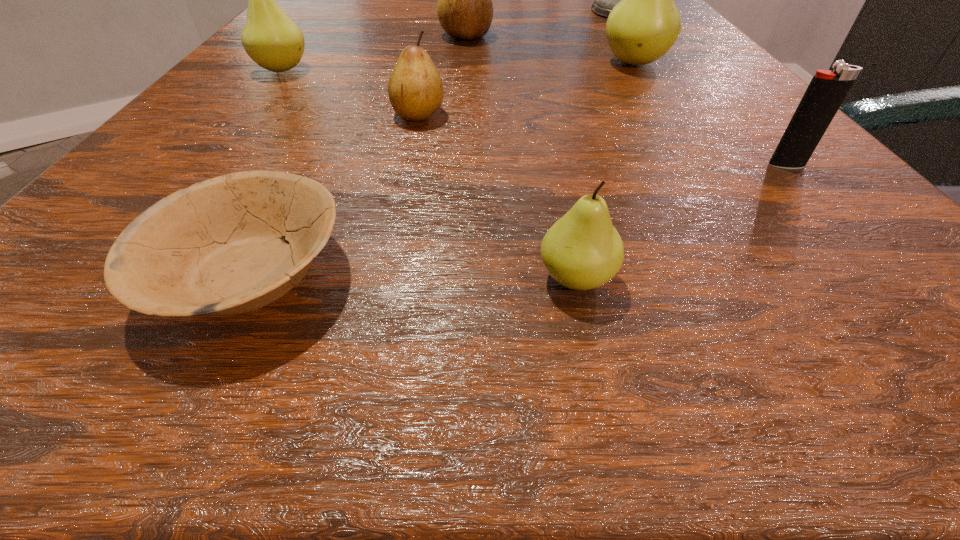
Locate an element on the screen. The height and width of the screenshot is (540, 960). vacant area that lies between the second green pear from right to left and the fourth nearest object is located at coordinates [x=497, y=196].

The width and height of the screenshot is (960, 540). I want to click on free point between the second smallest green pear and the aerosol can, so click(452, 40).

You are a GUI agent. You are given a task and a screenshot of the screen. Output one action in this format:
    pyautogui.click(x=<x>, y=<y>)
    Task: Click on the vacant space in between the black igniter and the second tallest object
    
    Given the screenshot: What is the action you would take?
    pyautogui.click(x=710, y=114)

You are a GUI agent. You are given a task and a screenshot of the screen. Output one action in this format:
    pyautogui.click(x=<x>, y=<y>)
    Task: Click on the unoccupied area between the second tallest object and the farthest pear
    
    Given the screenshot: What is the action you would take?
    pyautogui.click(x=550, y=50)

Locate an element on the screen. free space between the second pear from right to left and the fifth farthest object is located at coordinates (497, 196).

Identify the location of free space between the second farthest object and the second green pear from right to left. (521, 157).

This screenshot has height=540, width=960. Identify the location of vacant point located between the nearer brown pear and the tallest pear. (526, 89).

The image size is (960, 540). What are the coordinates of `vacant region between the gray aerosol can and the bigger brown pear` in the screenshot? It's located at (543, 24).

Where is `object that is the sixth closest to the shortest object`? The width and height of the screenshot is (960, 540). object that is the sixth closest to the shortest object is located at coordinates (465, 11).

At what (x,y) coordinates should I click in order to perform the action: click on object that is the seventh closest one to the black igniter. Please return your answer as a coordinate pair (x, y). The height and width of the screenshot is (540, 960). Looking at the image, I should click on (271, 39).